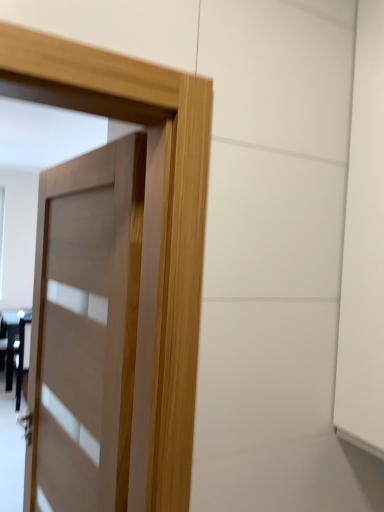
Question: In terms of width, does matte wood door at center look wider or thinner when compared to matte black table at lower left?

Choices:
 (A) wide
 (B) thin

Answer: (B)

Question: Is point (127, 84) positioned closer to the camera than point (6, 324)?

Choices:
 (A) closer
 (B) farther

Answer: (A)

Question: From their relative heights in the image, would you say matte wood door at center is taller or shorter than matte black table at lower left?

Choices:
 (A) tall
 (B) short

Answer: (A)

Question: Is matte black table at lower left inside or outside of matte wood door at center?

Choices:
 (A) outside
 (B) inside

Answer: (A)

Question: In the image, is matte black table at lower left on the left side or the right side of matte wood door at center?

Choices:
 (A) left
 (B) right

Answer: (A)

Question: In terms of height, does matte black table at lower left look taller or shorter compared to matte wood door at center?

Choices:
 (A) short
 (B) tall

Answer: (A)

Question: Is matte black table at lower left in front of or behind matte wood door at center in the image?

Choices:
 (A) front
 (B) behind

Answer: (B)